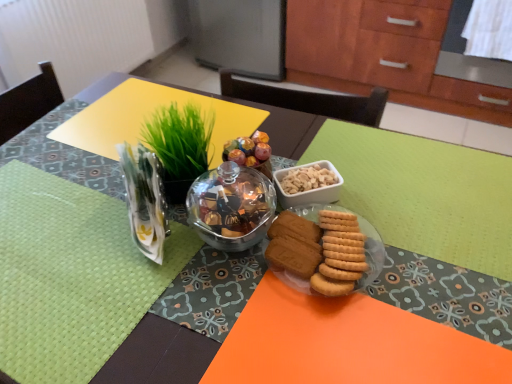
The image size is (512, 384). What are the coordinates of `vacant region above green woven placemat at left (from a real-world perspective)` in the screenshot? It's located at (52, 249).